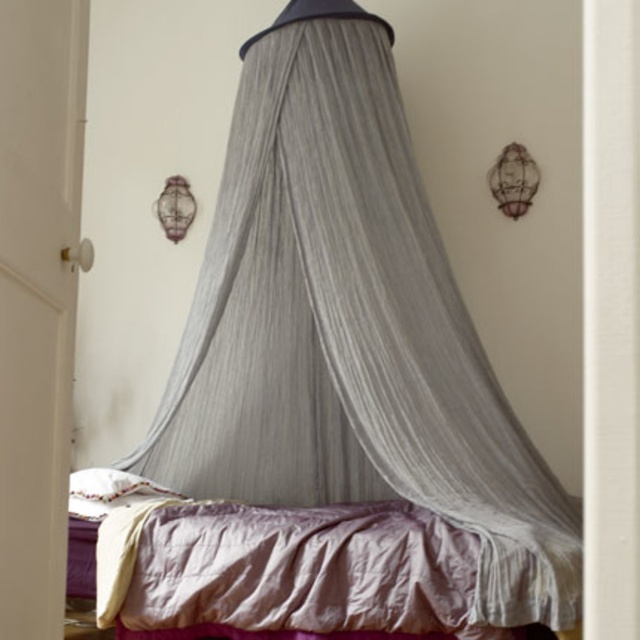
You are standing in the bedroom corner and want to hang a small fairy light decoration. The gray fabric canopy at upper center is at coordinates point 0.514, 0.548. If the recommended hanging point for the fairy lights is between 0.5 and 0.6 on both axes, will the canopy be a suitable location?

The gray fabric canopy at upper center is located at point (349, 328), which falls within the recommended hanging range of 0.5 to 0.6 on both axes. Therefore, the canopy is a suitable location for hanging the fairy lights.

You are standing in the bedroom and want to reach both the point at coordinates point [412,160] and point [227,518]. Which point is closer to you?

Point [227,518] is closer to you because it is nearer to the camera than point [412,160], which is further away.

You are a painter standing at the foot of the silky purple bed at center. You want to paint the gray fabric canopy at upper center but your longest brush is 20 inches. Can you reach the canopy with your brush?

The gray fabric canopy at upper center is 20.34 inches away from silky purple bed at center. Since your longest brush is only 20 inches, you cannot reach the canopy with your brush.